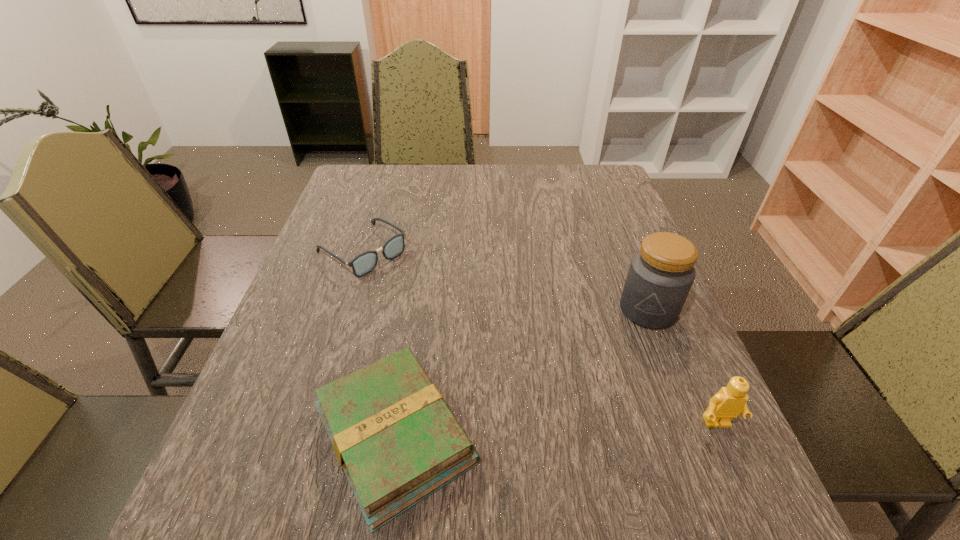
Where is `vacant space located 0.200m on the surface of the jar near the warning symbol`? This screenshot has width=960, height=540. vacant space located 0.200m on the surface of the jar near the warning symbol is located at coordinates (612, 395).

Where is `free space located on the surface of the jar near the warning symbol`? This screenshot has width=960, height=540. free space located on the surface of the jar near the warning symbol is located at coordinates (581, 465).

The image size is (960, 540). What are the coordinates of `book present at the near edge` in the screenshot? It's located at click(396, 440).

Identify the location of Lego that is at the near edge. coord(729,402).

Locate an element on the screen. book that is at the left edge is located at coordinates (396, 440).

The width and height of the screenshot is (960, 540). Find the location of `spectacles that is positioned at the left edge`. spectacles that is positioned at the left edge is located at coordinates point(364,263).

Identify the location of Lego situated at the right edge. click(x=729, y=402).

Find the location of `jar positioned at the right edge`. jar positioned at the right edge is located at coordinates (x=661, y=274).

I want to click on object that is at the near left corner, so click(x=396, y=440).

I want to click on object present at the near right corner, so click(x=729, y=402).